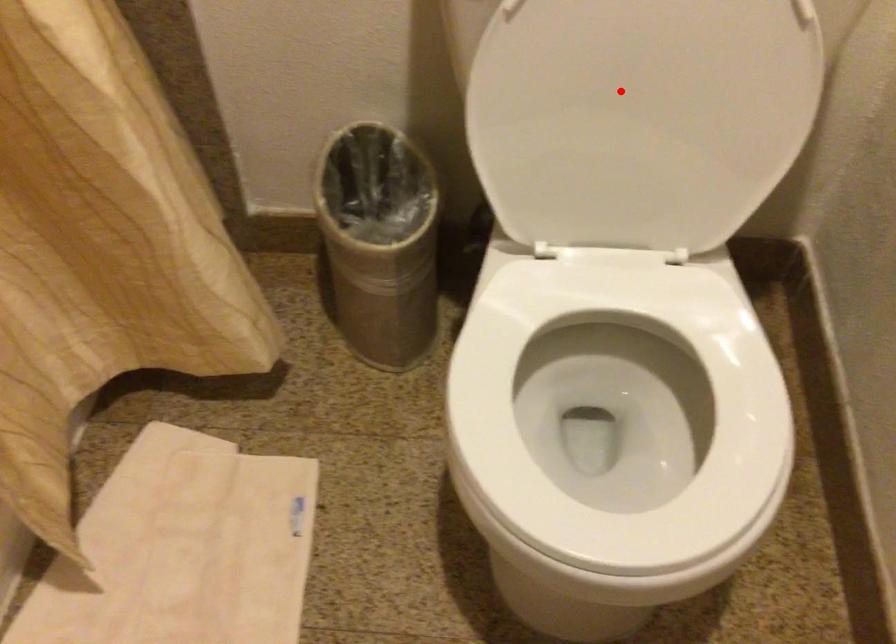
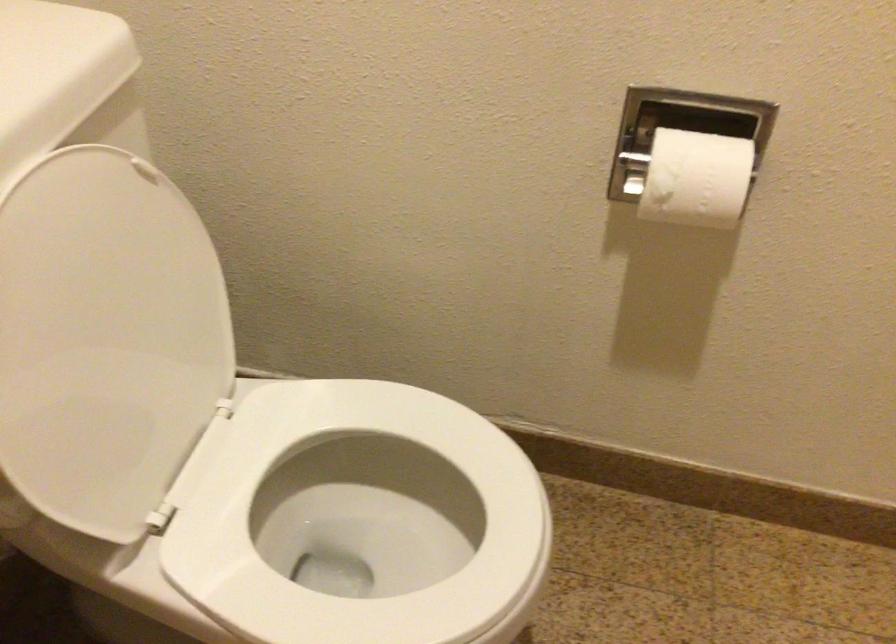
Question: I am providing you with two images of the same scene from different viewpoints. A red point is marked on the first image. At the location where the point appears in image 1, is it still visible in image 2?

Choices:
 (A) Yes
 (B) No

Answer: (A)